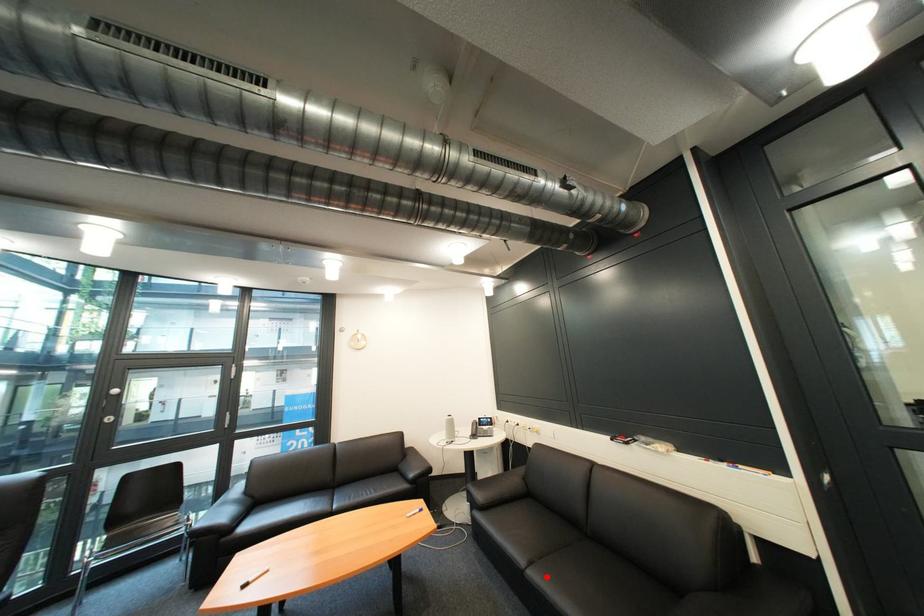
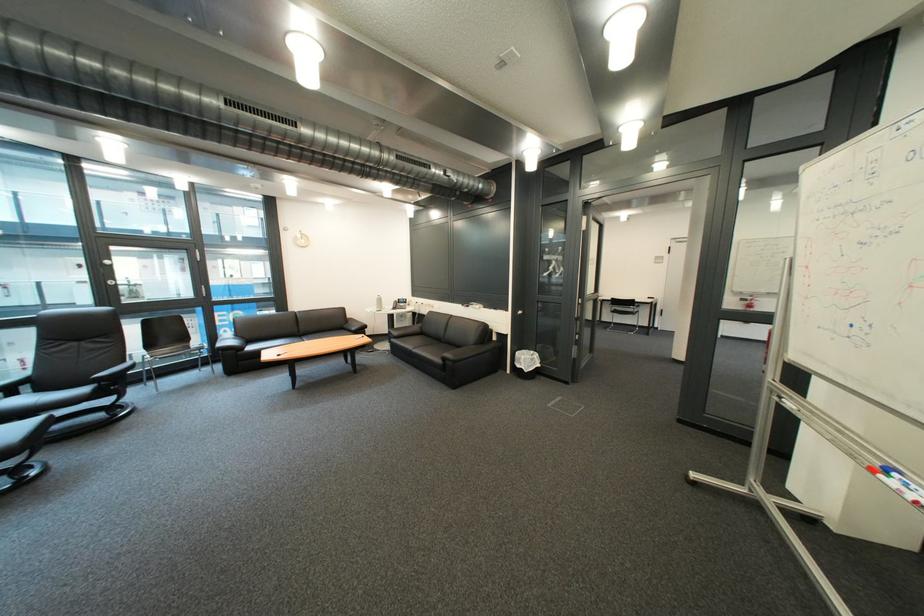
Question: I am providing you with two images of the same scene from different viewpoints. A red point is marked on the first image. Is the red point's position out of view in image 2?

Choices:
 (A) Yes
 (B) No

Answer: (B)